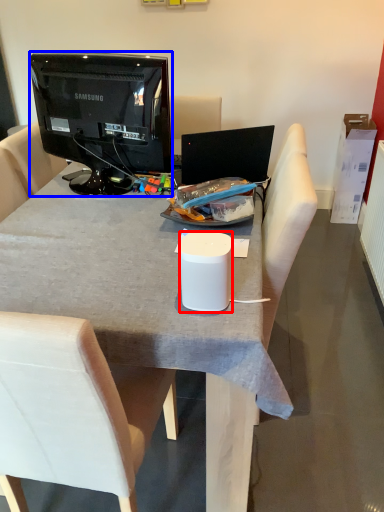
Question: Among these objects, which one is farthest to the camera, trash bin/can (highlighted by a red box) or television (highlighted by a blue box)?

Choices:
 (A) trash bin/can
 (B) television

Answer: (B)